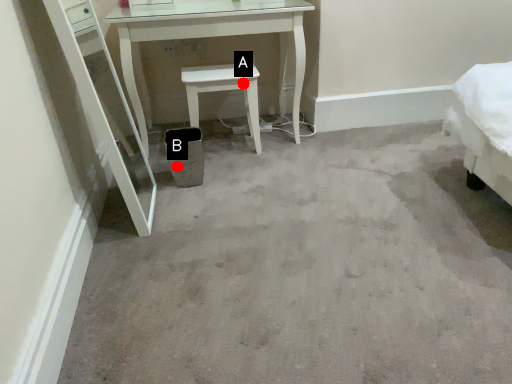
Question: Two points are circled on the image, labeled by A and B beside each circle. Which of the following is the closest to the observer?

Choices:
 (A) A is closer
 (B) B is closer

Answer: (A)